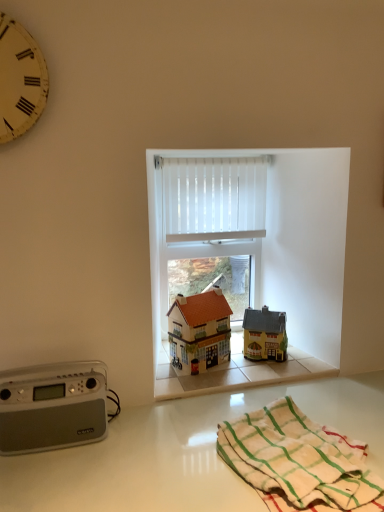
Locate an element on the screen. free space in front of matte orange roofed house at center, the first toy in the left-to-right sequence is located at coordinates (196, 382).